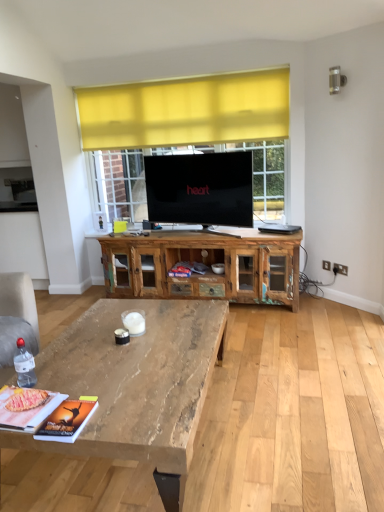
Question: Considering the relative sizes of natural wood coffee table at lower left and rustic wood cabinet at center in the image provided, is natural wood coffee table at lower left shorter than rustic wood cabinet at center?

Choices:
 (A) no
 (B) yes

Answer: (B)

Question: Considering the relative sizes of natural wood coffee table at lower left and rustic wood cabinet at center in the image provided, is natural wood coffee table at lower left bigger than rustic wood cabinet at center?

Choices:
 (A) yes
 (B) no

Answer: (A)

Question: Is natural wood coffee table at lower left closer to camera compared to rustic wood cabinet at center?

Choices:
 (A) no
 (B) yes

Answer: (B)

Question: Would you say natural wood coffee table at lower left is a long distance from rustic wood cabinet at center?

Choices:
 (A) no
 (B) yes

Answer: (B)

Question: From a real-world perspective, is natural wood coffee table at lower left positioned over rustic wood cabinet at center based on gravity?

Choices:
 (A) yes
 (B) no

Answer: (B)

Question: From a real-world perspective, is natural wood coffee table at lower left located beneath rustic wood cabinet at center?

Choices:
 (A) no
 (B) yes

Answer: (B)

Question: From the image's perspective, is rustic wood cabinet at center located beneath natural wood coffee table at lower left?

Choices:
 (A) yes
 (B) no

Answer: (B)

Question: Are rustic wood cabinet at center and natural wood coffee table at lower left far apart?

Choices:
 (A) yes
 (B) no

Answer: (A)

Question: From the image's perspective, is rustic wood cabinet at center located above natural wood coffee table at lower left?

Choices:
 (A) no
 (B) yes

Answer: (B)

Question: Considering the relative sizes of rustic wood cabinet at center and natural wood coffee table at lower left in the image provided, is rustic wood cabinet at center smaller than natural wood coffee table at lower left?

Choices:
 (A) yes
 (B) no

Answer: (A)

Question: Is rustic wood cabinet at center positioned in front of natural wood coffee table at lower left?

Choices:
 (A) no
 (B) yes

Answer: (A)

Question: Is rustic wood cabinet at center bigger than natural wood coffee table at lower left?

Choices:
 (A) yes
 (B) no

Answer: (B)

Question: From the image's perspective, is natural wood coffee table at lower left above or below rustic wood cabinet at center?

Choices:
 (A) above
 (B) below

Answer: (B)